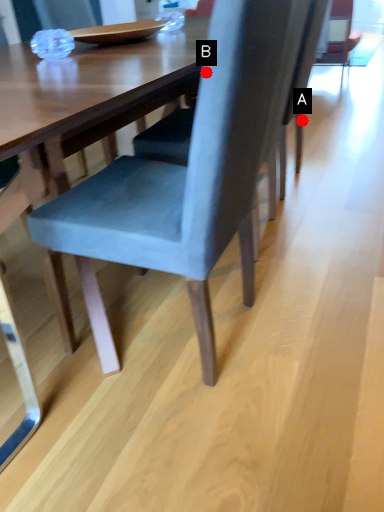
Question: Two points are circled on the image, labeled by A and B beside each circle. Which point appears farthest from the camera in this image?

Choices:
 (A) A is further
 (B) B is further

Answer: (A)